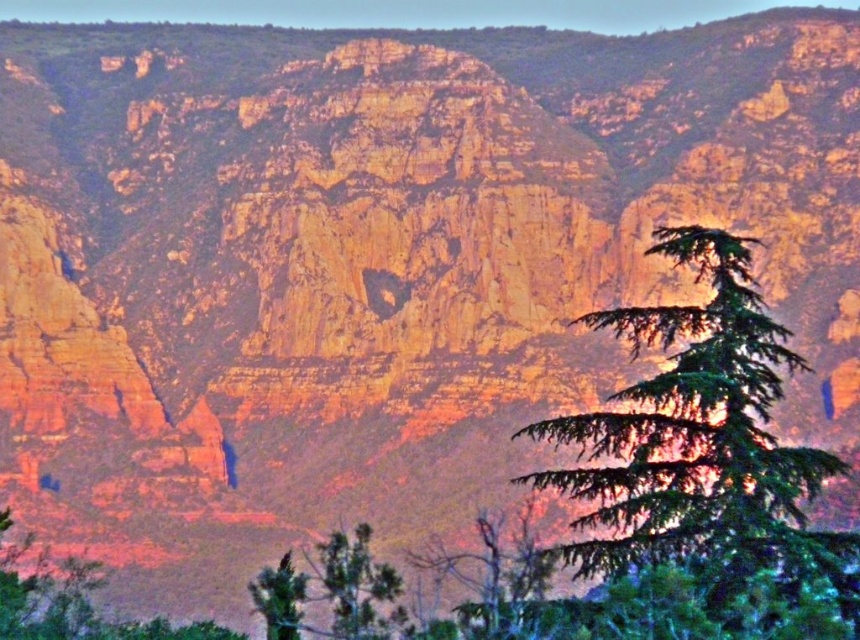
Who is positioned more to the left, green needle-like tree at right or green matte tree at lower center?

green matte tree at lower center is more to the left.

Can you confirm if green needle-like tree at right is positioned to the left of green matte tree at lower center?

In fact, green needle-like tree at right is to the right of green matte tree at lower center.

Who is more distant from viewer, (697, 508) or (290, 600)?

The point (290, 600) is behind.

Find the location of a particular element. This screenshot has width=860, height=640. green needle-like tree at right is located at coordinates (702, 442).

Who is more forward, (752,528) or (344,586)?

Point (752,528) is more forward.

What do you see at coordinates (702, 442) in the screenshot?
I see `green needle-like tree at right` at bounding box center [702, 442].

Describe the element at coordinates (702, 442) in the screenshot. Image resolution: width=860 pixels, height=640 pixels. I see `green needle-like tree at right` at that location.

You are a GUI agent. You are given a task and a screenshot of the screen. Output one action in this format:
    pyautogui.click(x=<x>, y=<y>)
    Task: Click on the green needle-like tree at right
    
    Given the screenshot: What is the action you would take?
    pyautogui.click(x=702, y=442)

Can you confirm if green matte tree at center is bigger than green matte tree at lower center?

Indeed, green matte tree at center has a larger size compared to green matte tree at lower center.

Between point (344, 605) and point (268, 625), which one is positioned behind?

Point (268, 625)

This screenshot has height=640, width=860. I want to click on green matte tree at center, so click(355, 588).